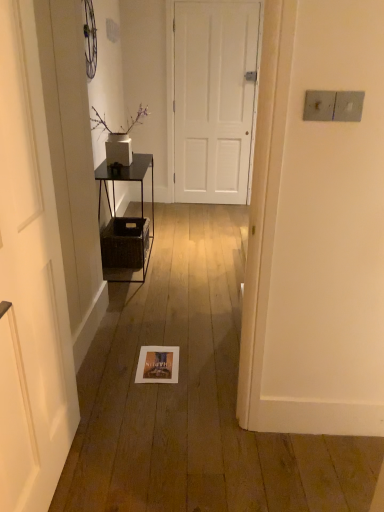
What do you see at coordinates (213, 99) in the screenshot? The image size is (384, 512). I see `white matte door at center, the 1th door from the top` at bounding box center [213, 99].

At what (x,y) coordinates should I click in order to perform the action: click on white matte door at left, the second door from the top. Please return your answer as a coordinate pair (x, y). Looking at the image, I should click on (30, 282).

Image resolution: width=384 pixels, height=512 pixels. Describe the element at coordinates (124, 242) in the screenshot. I see `woven brown crate at left` at that location.

At what (x,y) coordinates should I click in order to perform the action: click on black metal shelf at left. Please return your answer as a coordinate pair (x, y). Looking at the image, I should click on (141, 196).

Considering their positions, is black metal shelf at left located in front of or behind white matte door at left, which appears as the second door when viewed from the back?

black metal shelf at left is behind white matte door at left, which appears as the second door when viewed from the back.

Is black metal shelf at left taller or shorter than white matte door at left, which appears as the second door when viewed from the back?

Clearly, black metal shelf at left is shorter compared to white matte door at left, which appears as the second door when viewed from the back.

Is black metal shelf at left with white matte door at left, the 1th door ordered from the bottom?

No, black metal shelf at left is not beside white matte door at left, the 1th door ordered from the bottom.

Is white matte door at left, the 1th door ordered from the bottom, located within black metal shelf at left?

No.

How distant is black metal shelf at left from woven brown crate at left?

black metal shelf at left and woven brown crate at left are 32.81 centimeters apart.

Looking at this image, would you say woven brown crate at left is part of black metal shelf at left's contents?

Yes, woven brown crate at left can be found within black metal shelf at left.

Considering the positions of objects black metal shelf at left and woven brown crate at left in the image provided, who is more to the left, black metal shelf at left or woven brown crate at left?

From the viewer's perspective, woven brown crate at left appears more on the left side.

Which object is wider, black metal shelf at left or woven brown crate at left?

With larger width is black metal shelf at left.

In the image, is white matte door at center, which is the 2th door from front to back, positioned in front of or behind white matte door at left, the 1th door ordered from the bottom?

white matte door at center, which is the 2th door from front to back, is positioned farther from the viewer than white matte door at left, the 1th door ordered from the bottom.

Which is further, (229, 132) or (57, 482)?

Positioned behind is point (229, 132).

Between white matte door at center, the 1th door positioned from the back, and white matte door at left, which is the 1th door from front to back, which one has smaller width?

white matte door at center, the 1th door positioned from the back, is thinner.

Consider the image. From the image's perspective, is white matte door at center, the 1th door from the top, above or below white matte door at left, which appears as the first door when viewed from the left?

Based on their image positions, white matte door at center, the 1th door from the top, is located above white matte door at left, which appears as the first door when viewed from the left.

Between white matte door at left, which appears as the first door when viewed from the left, and white matte door at center, which appears as the first door when viewed from the right, which one has larger width?

white matte door at left, which appears as the first door when viewed from the left, is wider.

Considering the positions of objects white matte door at left, which appears as the second door when viewed from the back, and white matte door at center, which is the 2th door from front to back, in the image provided, who is behind, white matte door at left, which appears as the second door when viewed from the back, or white matte door at center, which is the 2th door from front to back,?

white matte door at center, which is the 2th door from front to back, is more distant.

This screenshot has height=512, width=384. In order to click on door below the white matte door at center, the second door viewed from the left (from a real-world perspective) in this screenshot , I will do `click(30, 282)`.

Would you say white matte door at left, which appears as the second door when viewed from the back, is to the left or to the right of white matte door at center, arranged as the 2th door when ordered from the bottom, in the picture?

white matte door at left, which appears as the second door when viewed from the back, is to the left of white matte door at center, arranged as the 2th door when ordered from the bottom.

Which of these two, white matte door at left, which appears as the second door when viewed from the back, or woven brown crate at left, is wider?

woven brown crate at left is wider.

From the image's perspective, is white matte door at left, positioned as the 2th door in right-to-left order, on top of woven brown crate at left?

No, from the image's perspective, white matte door at left, positioned as the 2th door in right-to-left order, is not over woven brown crate at left.

From a real-world perspective, which object rests below the other?

woven brown crate at left.

Find the location of a particular element. The height and width of the screenshot is (512, 384). crate that appears in front of the white matte door at center, the 1th door positioned from the back is located at coordinates (124, 242).

Is woven brown crate at left looking in the opposite direction of white matte door at center, which appears as the first door when viewed from the right?

That's not correct — woven brown crate at left is not looking away from white matte door at center, which appears as the first door when viewed from the right.

From the image's perspective, does woven brown crate at left appear higher than white matte door at center, the second door viewed from the left?

No.

Who is shorter, woven brown crate at left or white matte door at center, which is the 2th door from front to back?

Standing shorter between the two is woven brown crate at left.

Is woven brown crate at left wider than white matte door at left, which appears as the first door when viewed from the left?

Yes.

Where is `door in front of the woven brown crate at left`? The image size is (384, 512). door in front of the woven brown crate at left is located at coordinates (30, 282).

Is woven brown crate at left located outside white matte door at left, the second door from the top?

woven brown crate at left lies outside white matte door at left, the second door from the top,'s area.

Between woven brown crate at left and white matte door at left, which appears as the second door when viewed from the back, which one has more height?

With more height is white matte door at left, which appears as the second door when viewed from the back.

This screenshot has height=512, width=384. Find the location of `the 1st door counting from the right of the black metal shelf at left`. the 1st door counting from the right of the black metal shelf at left is located at coordinates (30, 282).

Where is `crate behind the black metal shelf at left`? The image size is (384, 512). crate behind the black metal shelf at left is located at coordinates (124, 242).

Which object lies nearer to the anchor point white matte door at left, the second door from the top, woven brown crate at left or white matte door at center, the 1th door from the top?

woven brown crate at left is positioned closer to the anchor white matte door at left, the second door from the top.

Considering their positions, is black metal shelf at left positioned closer to woven brown crate at left than white matte door at center, the 1th door from the top?

black metal shelf at left is positioned closer to the anchor woven brown crate at left.

From the image, which object appears to be farther from woven brown crate at left, white matte door at left, the 1th door ordered from the bottom, or white matte door at center, which is the 2th door from front to back?

white matte door at center, which is the 2th door from front to back.

Based on their spatial positions, is white matte door at center, arranged as the 2th door when ordered from the bottom, or black metal shelf at left closer to white matte door at left, which appears as the second door when viewed from the back?

black metal shelf at left is closer to white matte door at left, which appears as the second door when viewed from the back.

Consider the image. Which object lies nearer to the anchor point black metal shelf at left, white matte door at center, the 1th door from the top, or white matte door at left, which appears as the first door when viewed from the left?

Based on the image, white matte door at center, the 1th door from the top, appears to be nearer to black metal shelf at left.

Based on their spatial positions, is white matte door at left, positioned as the 2th door in right-to-left order, or woven brown crate at left further from white matte door at center, which appears as the first door when viewed from the right?

Among the two, white matte door at left, positioned as the 2th door in right-to-left order, is located further to white matte door at center, which appears as the first door when viewed from the right.

Considering their positions, is white matte door at left, which is the 1th door from front to back, positioned closer to black metal shelf at left than white matte door at center, the second door viewed from the left?

Among the two, white matte door at center, the second door viewed from the left, is located nearer to black metal shelf at left.

Considering their positions, is black metal shelf at left positioned closer to woven brown crate at left than white matte door at left, positioned as the 2th door in right-to-left order?

black metal shelf at left is positioned closer to the anchor woven brown crate at left.

This screenshot has height=512, width=384. In order to click on crate between white matte door at left, the 1th door ordered from the bottom, and white matte door at center, which is the 2th door from front to back, in the front-back direction in this screenshot , I will do `click(124, 242)`.

The height and width of the screenshot is (512, 384). I want to click on table between white matte door at center, which is the 2th door from front to back, and woven brown crate at left vertically, so click(x=141, y=196).

At what (x,y) coordinates should I click in order to perform the action: click on table located between white matte door at left, which appears as the first door when viewed from the left, and white matte door at center, arranged as the 2th door when ordered from the bottom, in the depth direction. Please return your answer as a coordinate pair (x, y). Image resolution: width=384 pixels, height=512 pixels. Looking at the image, I should click on (141, 196).

Locate an element on the screen. The width and height of the screenshot is (384, 512). table located between white matte door at left, positioned as the 2th door in right-to-left order, and woven brown crate at left in the depth direction is located at coordinates (141, 196).